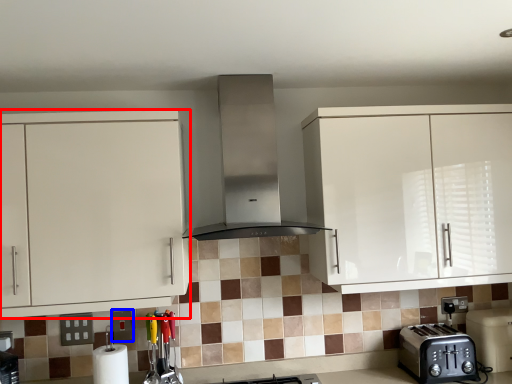
Question: Among these objects, which one is farthest to the camera, cabinetry (highlighted by a red box) or square (highlighted by a blue box)?

Choices:
 (A) cabinetry
 (B) square

Answer: (B)